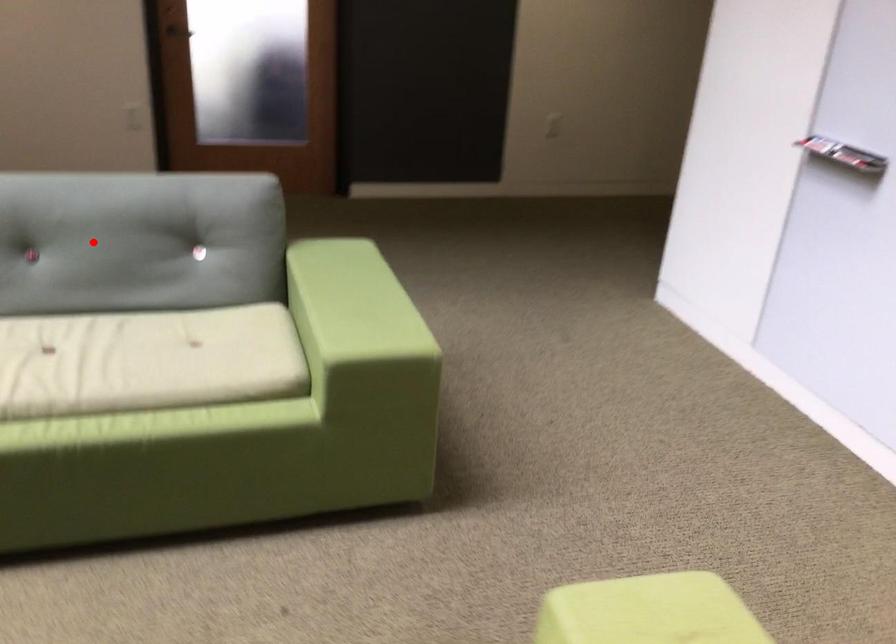
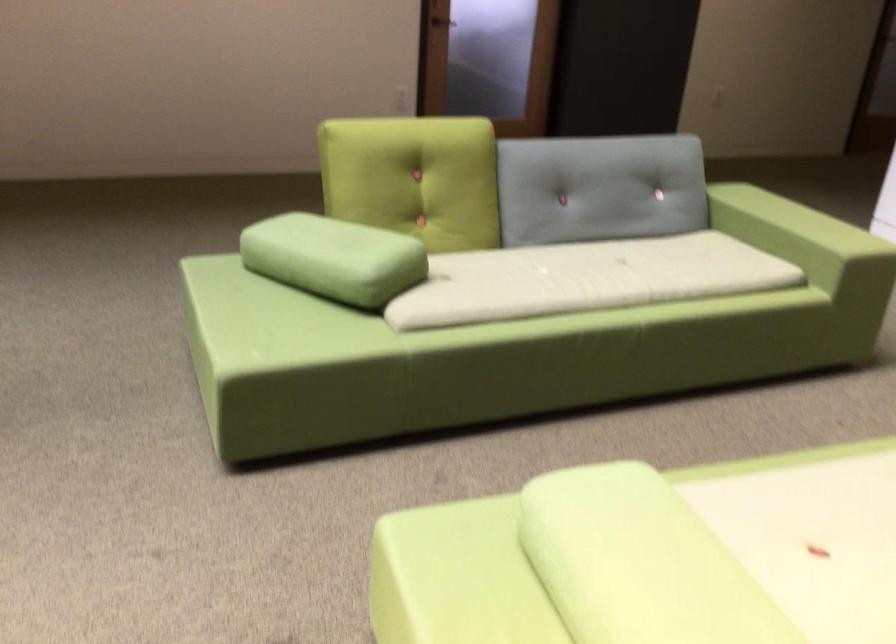
Question: I am providing you with two images of the same scene from different viewpoints. Image1 has a red point marked. In image2, the corresponding 3D location appears at what relative position? Reply with the corresponding letter.

Choices:
 (A) Closer
 (B) Farther

Answer: (B)